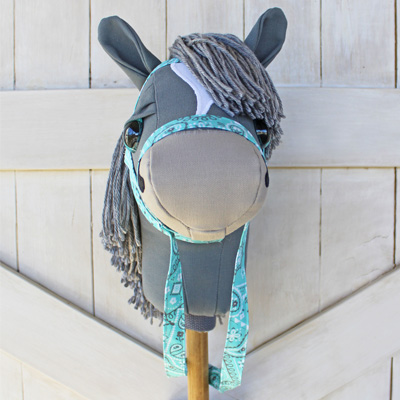
In order to click on diagonal wooden boards in this screenshot , I will do `click(46, 322)`, `click(334, 346)`.